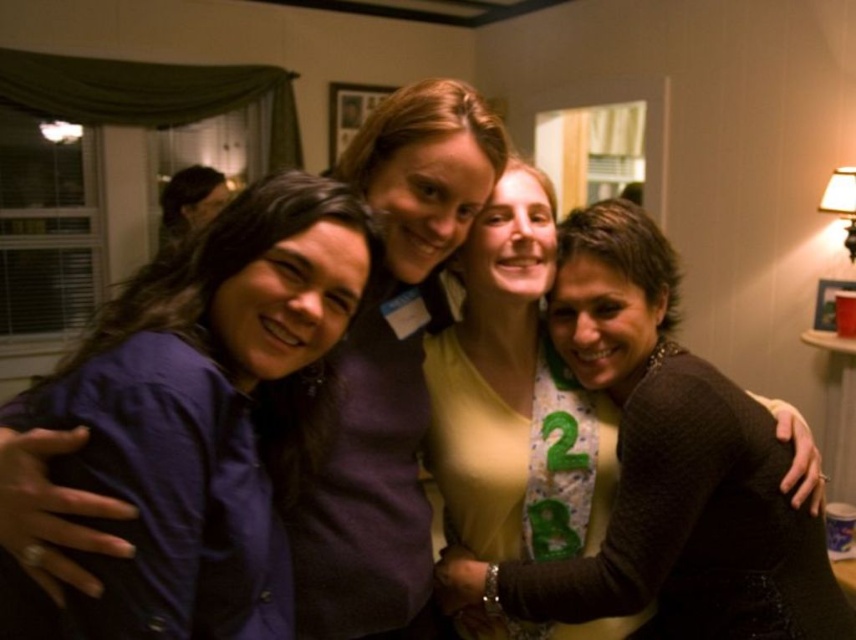
Question: Among these objects, which one is farthest from the camera?

Choices:
 (A) dark blue shirt at left
 (B) matte brown sweater at center

Answer: (B)

Question: Among these objects, which one is farthest from the camera?

Choices:
 (A) matte brown sweater at center
 (B) dark blue shirt at left

Answer: (A)

Question: Is dark blue shirt at left smaller than matte brown sweater at center?

Choices:
 (A) yes
 (B) no

Answer: (A)

Question: Does dark blue shirt at left have a greater width compared to matte brown sweater at center?

Choices:
 (A) yes
 (B) no

Answer: (B)

Question: Is dark blue shirt at left thinner than matte brown sweater at center?

Choices:
 (A) yes
 (B) no

Answer: (A)